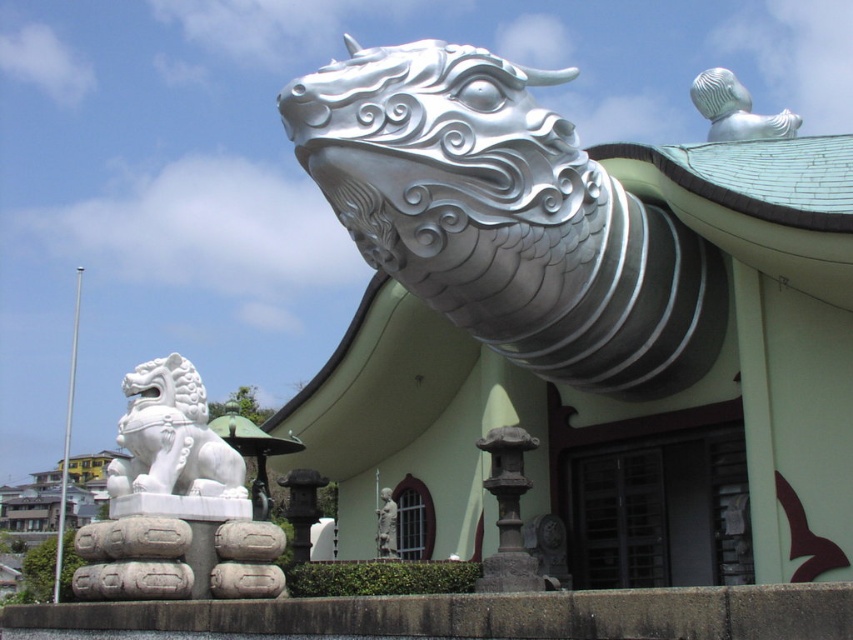
Based on the scene description, what object is located at the coordinates point (302, 508)?

The smooth stone lantern at center is located at point (302, 508).

You are a visitor standing in front of the temple. You want to take a photo of both the polished silver dragon head at upper right and the white stone lion at left. Which object should you focus on first to ensure both are in frame?

You should focus on the polished silver dragon head at upper right first because it is closer to you than the white stone lion at left, so adjusting the camera to include both would require ensuring the dragon head is centered before including the lion in the background.